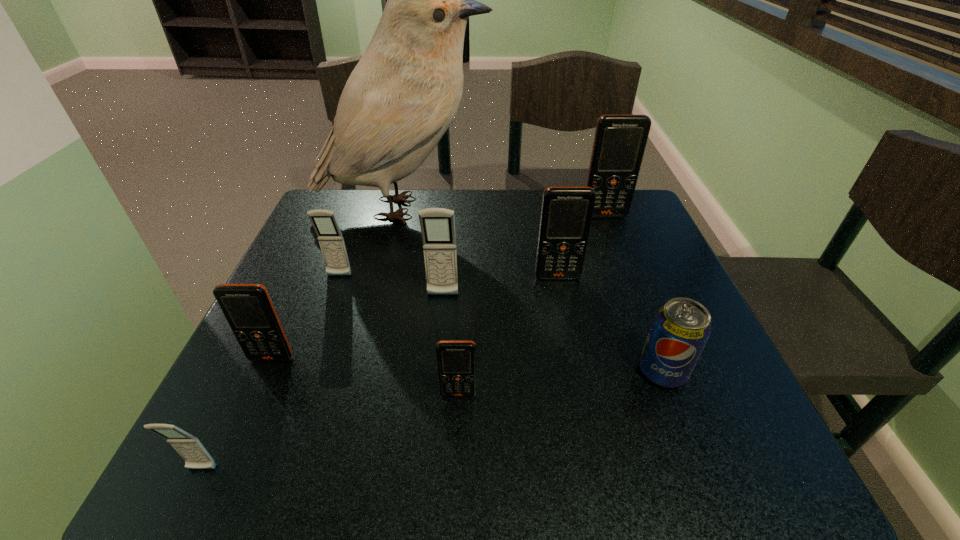
Locate an element on the screen. The image size is (960, 540). soda present at the right edge is located at coordinates (681, 328).

Find the location of `object that is positioned at the far left corner`. object that is positioned at the far left corner is located at coordinates (403, 94).

Find the location of a particular element. The width and height of the screenshot is (960, 540). object present at the near left corner is located at coordinates (189, 447).

Identify the location of object that is positioned at the far right corner. (620, 140).

Locate an element on the screen. free location at the far edge of the desktop is located at coordinates (526, 204).

Identify the location of free region at the near edge of the desktop. (632, 430).

At what (x,y) coordinates should I click in order to perform the action: click on vacant space at the left edge. Please return your answer as a coordinate pair (x, y). The width and height of the screenshot is (960, 540). Looking at the image, I should click on (297, 260).

I want to click on vacant space at the right edge of the desktop, so click(613, 249).

In the image, there is a desktop. At what (x,y) coordinates should I click in order to perform the action: click on vacant space at the far left corner. Please return your answer as a coordinate pair (x, y). This screenshot has width=960, height=540. Looking at the image, I should click on (304, 237).

In the image, there is a desktop. Where is `vacant space at the near left corner`? vacant space at the near left corner is located at coordinates (197, 435).